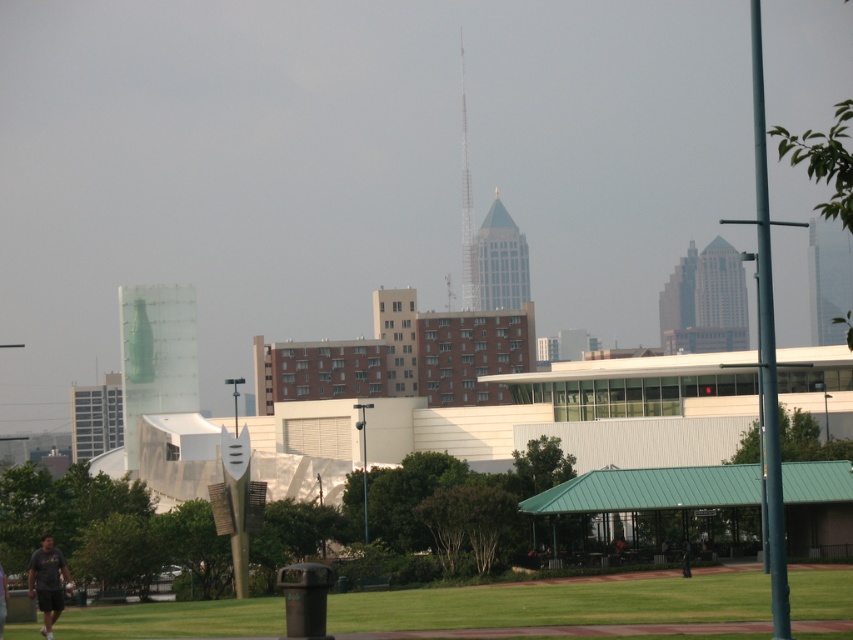
Question: Which object is closer to the camera taking this photo?

Choices:
 (A) dark gray shirt at lower center
 (B) dark gray t-shirt at lower left

Answer: (B)

Question: Does dark gray t-shirt at lower left have a larger size compared to dark gray shirt at lower center?

Choices:
 (A) yes
 (B) no

Answer: (A)

Question: Can you confirm if dark gray t-shirt at lower left is positioned to the left of dark gray shirt at lower center?

Choices:
 (A) yes
 (B) no

Answer: (A)

Question: Does dark gray t-shirt at lower left appear on the right side of dark gray shirt at lower center?

Choices:
 (A) yes
 (B) no

Answer: (B)

Question: Which point is farther from the camera taking this photo?

Choices:
 (A) (33, 552)
 (B) (682, 573)

Answer: (A)

Question: Which point appears farthest from the camera in this image?

Choices:
 (A) (28, 582)
 (B) (683, 545)

Answer: (B)